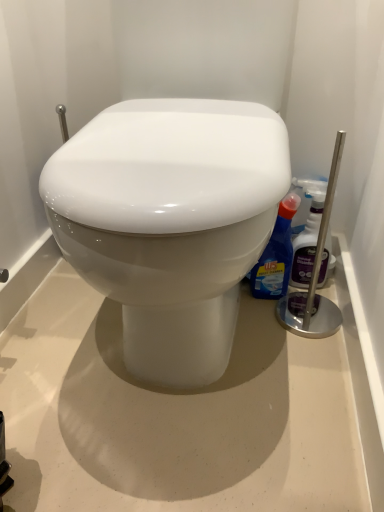
This screenshot has width=384, height=512. Describe the element at coordinates (307, 242) in the screenshot. I see `translucent plastic spray bottle at right, arranged as the 1th cleaning product when viewed from the right` at that location.

You are a GUI agent. You are given a task and a screenshot of the screen. Output one action in this format:
    pyautogui.click(x=<x>, y=<y>)
    Task: Click on the translucent plastic spray bottle at right, which is the second cleaning product from left to right
    The height and width of the screenshot is (512, 384).
    Given the screenshot: What is the action you would take?
    pyautogui.click(x=307, y=242)

What do you see at coordinates (276, 255) in the screenshot? I see `blue glossy toilet cleaner at right, marked as the 2th cleaning product in a right-to-left arrangement` at bounding box center [276, 255].

At what (x,y) coordinates should I click in order to perform the action: click on blue glossy toilet cleaner at right, marked as the 2th cleaning product in a right-to-left arrangement. Please return your answer as a coordinate pair (x, y). Looking at the image, I should click on (276, 255).

Consider the image. How much space does blue glossy toilet cleaner at right, which is the first cleaning product in left-to-right order, occupy horizontally?

10.94 centimeters.

Where is `translucent plastic spray bottle at right, which is the second cleaning product from left to right`? translucent plastic spray bottle at right, which is the second cleaning product from left to right is located at coordinates (307, 242).

Considering the relative positions of blue glossy toilet cleaner at right, which is the first cleaning product in left-to-right order, and translucent plastic spray bottle at right, which is the second cleaning product from left to right, in the image provided, is blue glossy toilet cleaner at right, which is the first cleaning product in left-to-right order, to the left or to the right of translucent plastic spray bottle at right, which is the second cleaning product from left to right,?

blue glossy toilet cleaner at right, which is the first cleaning product in left-to-right order, is to the left of translucent plastic spray bottle at right, which is the second cleaning product from left to right.

Based on the photo, considering the positions of objects blue glossy toilet cleaner at right, which is the first cleaning product in left-to-right order, and translucent plastic spray bottle at right, arranged as the 1th cleaning product when viewed from the right, in the image provided, who is in front, blue glossy toilet cleaner at right, which is the first cleaning product in left-to-right order, or translucent plastic spray bottle at right, arranged as the 1th cleaning product when viewed from the right,?

blue glossy toilet cleaner at right, which is the first cleaning product in left-to-right order, is in front.

Is point (262, 286) less distant than point (330, 243)?

Yes, point (262, 286) is in front of point (330, 243).

From the image's perspective, which is above, blue glossy toilet cleaner at right, marked as the 2th cleaning product in a right-to-left arrangement, or translucent plastic spray bottle at right, arranged as the 1th cleaning product when viewed from the right?

translucent plastic spray bottle at right, arranged as the 1th cleaning product when viewed from the right, is shown above in the image.

From a real-world perspective, which object stands above the other?

In real-world perspective, translucent plastic spray bottle at right, which is the second cleaning product from left to right, is above.

Does blue glossy toilet cleaner at right, which is the first cleaning product in left-to-right order, have a greater width compared to translucent plastic spray bottle at right, which is the second cleaning product from left to right?

Yes.

Considering the relative sizes of blue glossy toilet cleaner at right, marked as the 2th cleaning product in a right-to-left arrangement, and translucent plastic spray bottle at right, arranged as the 1th cleaning product when viewed from the right, in the image provided, is blue glossy toilet cleaner at right, marked as the 2th cleaning product in a right-to-left arrangement, shorter than translucent plastic spray bottle at right, arranged as the 1th cleaning product when viewed from the right,?

Correct, blue glossy toilet cleaner at right, marked as the 2th cleaning product in a right-to-left arrangement, is not as tall as translucent plastic spray bottle at right, arranged as the 1th cleaning product when viewed from the right.

Can you confirm if blue glossy toilet cleaner at right, marked as the 2th cleaning product in a right-to-left arrangement, is bigger than translucent plastic spray bottle at right, arranged as the 1th cleaning product when viewed from the right?

Correct, blue glossy toilet cleaner at right, marked as the 2th cleaning product in a right-to-left arrangement, is larger in size than translucent plastic spray bottle at right, arranged as the 1th cleaning product when viewed from the right.

Is blue glossy toilet cleaner at right, which is the first cleaning product in left-to-right order, positioned beyond the bounds of translucent plastic spray bottle at right, which is the second cleaning product from left to right?

blue glossy toilet cleaner at right, which is the first cleaning product in left-to-right order, is positioned outside translucent plastic spray bottle at right, which is the second cleaning product from left to right.

Is there a large distance between blue glossy toilet cleaner at right, marked as the 2th cleaning product in a right-to-left arrangement, and translucent plastic spray bottle at right, which is the second cleaning product from left to right?

Actually, blue glossy toilet cleaner at right, marked as the 2th cleaning product in a right-to-left arrangement, and translucent plastic spray bottle at right, which is the second cleaning product from left to right, are a little close together.

Is blue glossy toilet cleaner at right, marked as the 2th cleaning product in a right-to-left arrangement, turned away from translucent plastic spray bottle at right, which is the second cleaning product from left to right?

No.

How different are the orientations of blue glossy toilet cleaner at right, which is the first cleaning product in left-to-right order, and translucent plastic spray bottle at right, arranged as the 1th cleaning product when viewed from the right, in degrees?

The angular difference between blue glossy toilet cleaner at right, which is the first cleaning product in left-to-right order, and translucent plastic spray bottle at right, arranged as the 1th cleaning product when viewed from the right, is 1.23 degrees.

Could you measure the distance between blue glossy toilet cleaner at right, marked as the 2th cleaning product in a right-to-left arrangement, and translucent plastic spray bottle at right, arranged as the 1th cleaning product when viewed from the right?

The distance of blue glossy toilet cleaner at right, marked as the 2th cleaning product in a right-to-left arrangement, from translucent plastic spray bottle at right, arranged as the 1th cleaning product when viewed from the right, is 2.37 inches.

In the image, there is a blue glossy toilet cleaner at right, which is the first cleaning product in left-to-right order. Find the location of `cleaning product above it (from the image's perspective)`. cleaning product above it (from the image's perspective) is located at coordinates (307, 242).

Considering the positions of objects translucent plastic spray bottle at right, which is the second cleaning product from left to right, and blue glossy toilet cleaner at right, marked as the 2th cleaning product in a right-to-left arrangement, in the image provided, who is more to the left, translucent plastic spray bottle at right, which is the second cleaning product from left to right, or blue glossy toilet cleaner at right, marked as the 2th cleaning product in a right-to-left arrangement,?

Positioned to the left is blue glossy toilet cleaner at right, marked as the 2th cleaning product in a right-to-left arrangement.

Considering the relative positions of translucent plastic spray bottle at right, which is the second cleaning product from left to right, and blue glossy toilet cleaner at right, marked as the 2th cleaning product in a right-to-left arrangement, in the image provided, is translucent plastic spray bottle at right, which is the second cleaning product from left to right, behind blue glossy toilet cleaner at right, marked as the 2th cleaning product in a right-to-left arrangement,?

Yes, translucent plastic spray bottle at right, which is the second cleaning product from left to right, is behind blue glossy toilet cleaner at right, marked as the 2th cleaning product in a right-to-left arrangement.

Is point (312, 193) closer to camera compared to point (281, 242)?

Yes, point (312, 193) is in front of point (281, 242).

From the image's perspective, would you say translucent plastic spray bottle at right, which is the second cleaning product from left to right, is positioned over blue glossy toilet cleaner at right, marked as the 2th cleaning product in a right-to-left arrangement?

Yes, from the image's perspective, translucent plastic spray bottle at right, which is the second cleaning product from left to right, is above blue glossy toilet cleaner at right, marked as the 2th cleaning product in a right-to-left arrangement.

From a real-world perspective, is translucent plastic spray bottle at right, which is the second cleaning product from left to right, physically located above or below blue glossy toilet cleaner at right, which is the first cleaning product in left-to-right order?

translucent plastic spray bottle at right, which is the second cleaning product from left to right, is situated higher than blue glossy toilet cleaner at right, which is the first cleaning product in left-to-right order, in the real world.

Consider the image. Which object is thinner, translucent plastic spray bottle at right, arranged as the 1th cleaning product when viewed from the right, or blue glossy toilet cleaner at right, marked as the 2th cleaning product in a right-to-left arrangement?

With smaller width is translucent plastic spray bottle at right, arranged as the 1th cleaning product when viewed from the right.

Which of these two, translucent plastic spray bottle at right, which is the second cleaning product from left to right, or blue glossy toilet cleaner at right, which is the first cleaning product in left-to-right order, stands shorter?

blue glossy toilet cleaner at right, which is the first cleaning product in left-to-right order.

Is translucent plastic spray bottle at right, which is the second cleaning product from left to right, bigger or smaller than blue glossy toilet cleaner at right, which is the first cleaning product in left-to-right order?

In the image, translucent plastic spray bottle at right, which is the second cleaning product from left to right, appears to be smaller than blue glossy toilet cleaner at right, which is the first cleaning product in left-to-right order.

Do you think translucent plastic spray bottle at right, which is the second cleaning product from left to right, is within blue glossy toilet cleaner at right, marked as the 2th cleaning product in a right-to-left arrangement, or outside of it?

translucent plastic spray bottle at right, which is the second cleaning product from left to right, cannot be found inside blue glossy toilet cleaner at right, marked as the 2th cleaning product in a right-to-left arrangement.

Is translucent plastic spray bottle at right, which is the second cleaning product from left to right, not close to blue glossy toilet cleaner at right, marked as the 2th cleaning product in a right-to-left arrangement?

No.

Is translucent plastic spray bottle at right, which is the second cleaning product from left to right, positioned with its back to blue glossy toilet cleaner at right, which is the first cleaning product in left-to-right order?

No, blue glossy toilet cleaner at right, which is the first cleaning product in left-to-right order, is not at the back of translucent plastic spray bottle at right, which is the second cleaning product from left to right.

Image resolution: width=384 pixels, height=512 pixels. Find the location of `cleaning product on the left of the translucent plastic spray bottle at right, arranged as the 1th cleaning product when viewed from the right`. cleaning product on the left of the translucent plastic spray bottle at right, arranged as the 1th cleaning product when viewed from the right is located at coordinates (276, 255).

Locate an element on the screen. cleaning product below the translucent plastic spray bottle at right, which is the second cleaning product from left to right (from a real-world perspective) is located at coordinates (276, 255).

Identify the location of cleaning product located behind the blue glossy toilet cleaner at right, which is the first cleaning product in left-to-right order. The width and height of the screenshot is (384, 512). (307, 242).